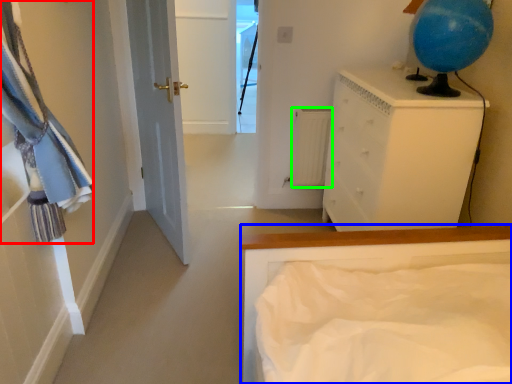
Question: Which object is the closest to the laundry (highlighted by a red box)? Choose among these: bed (highlighted by a blue box) or radiator (highlighted by a green box).

Choices:
 (A) bed
 (B) radiator

Answer: (A)